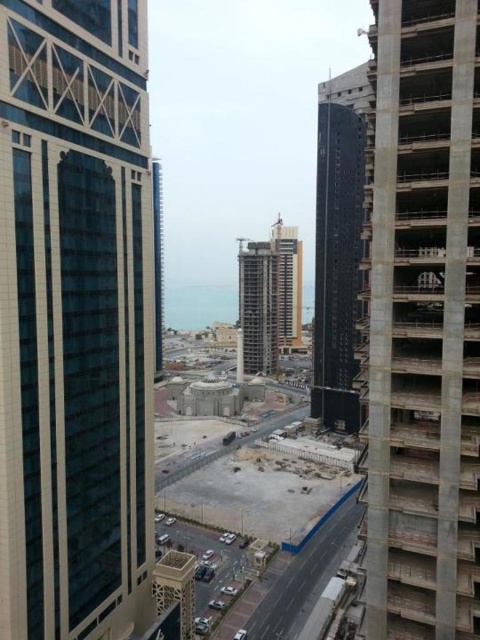
You are a delivery driver who needs to drop off materials to the white concrete construction site at center. Your GPS shows that you are currently at point 0.811, 0.544. Is the GPS location accurate?

Yes, the GPS location is accurate because the white concrete construction site at center is indeed located at point [261,518].

You are a city planner assessing the urban layout. Given the white concrete construction site at center and the black glass tower at center, which one is shorter?

The white concrete construction site at center is shorter than the black glass tower at center.

You are a delivery driver approaching the construction site. You need to deliver supplies to the construction site at the concrete at right. However, there is a glassy concrete skyscraper at center blocking your path. Can you drive around it to reach the site?

The concrete at right is in front of the glassy concrete skyscraper at center, so the skyscraper is behind the construction site. Therefore, you can drive around the glassy concrete skyscraper at center to reach the concrete at right without obstruction.